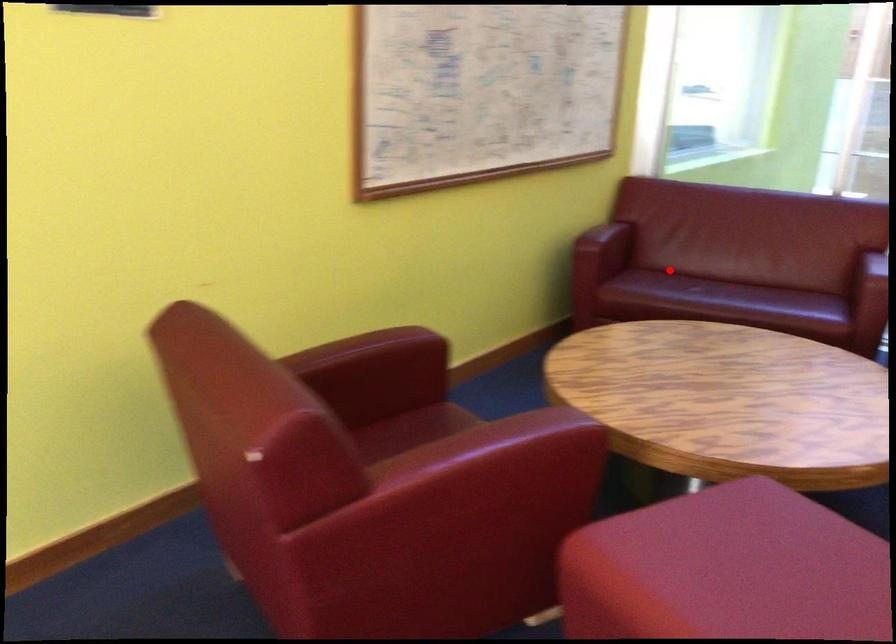
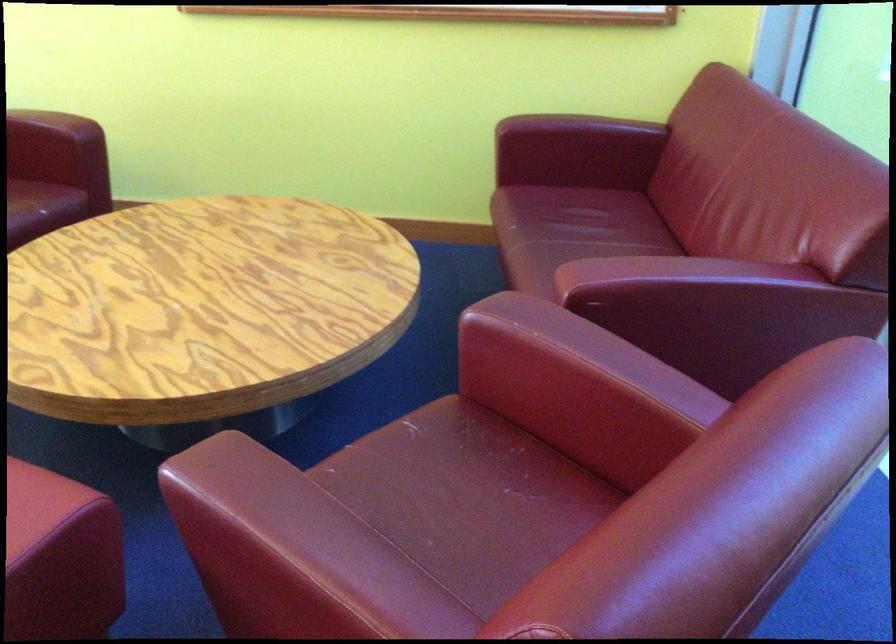
Question: A red point is marked in image1. In image2, is the corresponding 3D point closer to the camera or farther? Reply with the corresponding letter.

Choices:
 (A) The corresponding 3D point is closer.
 (B) The corresponding 3D point is farther.

Answer: (A)